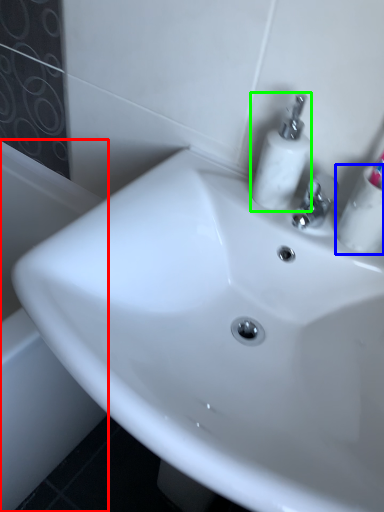
Question: Estimate the real-world distances between objects in this image. Which object is farther from bath (highlighted by a red box), mouthwash (highlighted by a blue box) or soap dispenser (highlighted by a green box)?

Choices:
 (A) mouthwash
 (B) soap dispenser

Answer: (A)